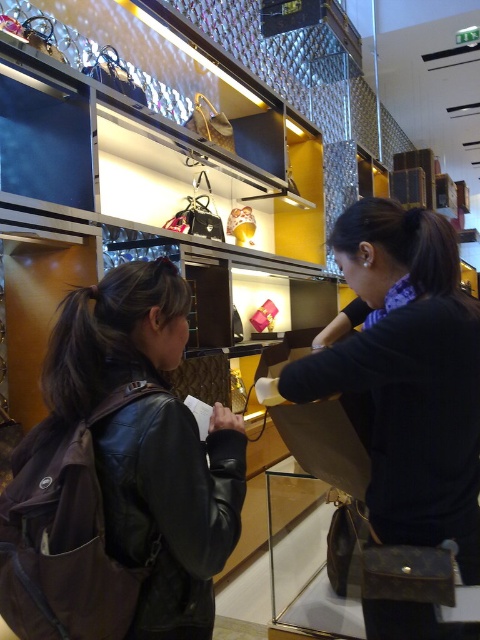
You are a customer in the store and want to try on both the black leather jacket at lower left and the leather jacket at center. Which jacket should you pick up first to follow the store layout from left to right?

The black leather jacket at lower left should be picked up first since it is positioned to the left of the leather jacket at center, following the store layout from left to right.

You are a store employee who needs to restock a rack that can only hold items within a 12 inch width. You see the black leather jacket at lower left and the leather jacket at center. Can both jackets fit side by side on the rack without overlapping?

The black leather jacket at lower left and the leather jacket at center are 15.22 inches apart from each other. Since the rack can only hold items within a 12 inch width, they cannot fit side by side without overlapping.